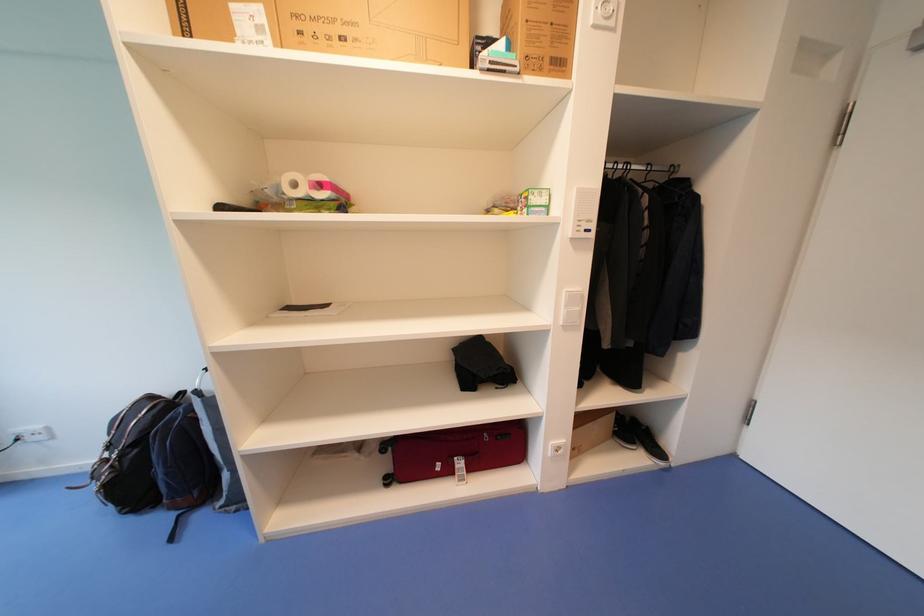
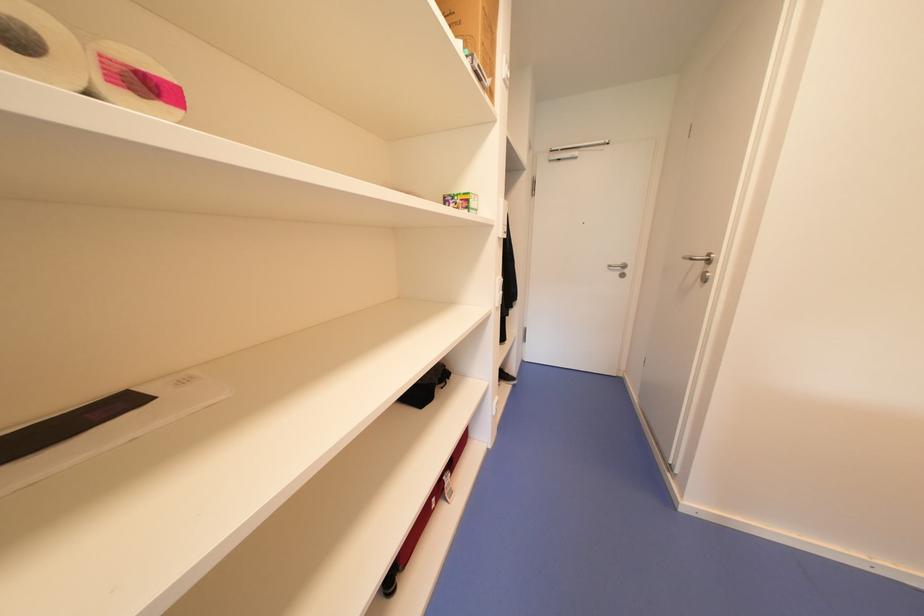
Question: The images are taken continuously from a first-person perspective. In which direction is your viewpoint rotating?

Choices:
 (A) Left
 (B) Right
 (C) Up
 (D) Down

Answer: (B)